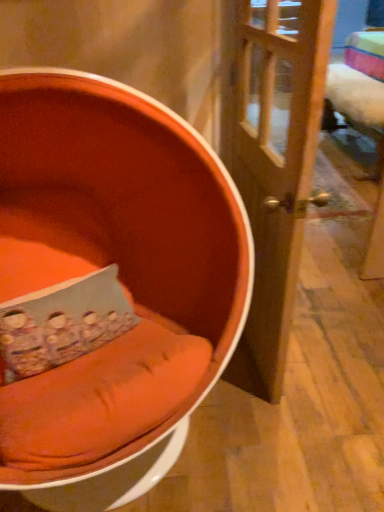
The image size is (384, 512). In order to click on wooden door at center in this screenshot , I will do `click(275, 168)`.

Which is behind, wooden door at center or floral fabric pillow at center?

floral fabric pillow at center is behind.

Is wooden door at center inside the boundaries of floral fabric pillow at center, or outside?

wooden door at center lies outside floral fabric pillow at center.

Is wooden door at center facing away from floral fabric pillow at center?

Correct, wooden door at center is looking away from floral fabric pillow at center.

In order to click on pillow located below the wooden door at center (from the image's perspective) in this screenshot , I will do `click(62, 323)`.

Locate an element on the screen. The width and height of the screenshot is (384, 512). chair that is under the wooden door at center (from a real-world perspective) is located at coordinates (110, 285).

Which object is positioned more to the right, wooden door at center or orange fabric chair at left?

Positioned to the right is wooden door at center.

From a real-world perspective, which is physically above, wooden door at center or orange fabric chair at left?

wooden door at center.

Consider the image. From a real-world perspective, is floral fabric pillow at center below orange fabric chair at left?

Correct, in the physical world, floral fabric pillow at center is lower than orange fabric chair at left.

Is orange fabric chair at left at the back of floral fabric pillow at center?

Yes.

Would you say floral fabric pillow at center is inside or outside orange fabric chair at left?

floral fabric pillow at center is spatially positioned inside orange fabric chair at left.

Where is `door on the right of floral fabric pillow at center`? This screenshot has width=384, height=512. door on the right of floral fabric pillow at center is located at coordinates (275, 168).

Is floral fabric pillow at center turned away from wooden door at center?

No, floral fabric pillow at center's orientation is not away from wooden door at center.

Does floral fabric pillow at center have a greater width compared to wooden door at center?

Indeed, floral fabric pillow at center has a greater width compared to wooden door at center.

Would you say wooden door at center is part of floral fabric pillow at center's contents?

Actually, wooden door at center is outside floral fabric pillow at center.

Is floral fabric pillow at center a part of orange fabric chair at left?

Yes, orange fabric chair at left is surrounding floral fabric pillow at center.

From a real-world perspective, is orange fabric chair at left physically located above or below floral fabric pillow at center?

orange fabric chair at left is situated higher than floral fabric pillow at center in the real world.

The height and width of the screenshot is (512, 384). In order to click on chair lying in front of the floral fabric pillow at center in this screenshot , I will do `click(110, 285)`.

Is orange fabric chair at left facing towards wooden door at center?

No, orange fabric chair at left is not aimed at wooden door at center.

Considering the sizes of objects orange fabric chair at left and wooden door at center in the image provided, who is shorter, orange fabric chair at left or wooden door at center?

orange fabric chair at left.

Does orange fabric chair at left contain wooden door at center?

No, wooden door at center is located outside of orange fabric chair at left.

This screenshot has width=384, height=512. Find the location of `pillow that appears below the wooden door at center (from the image's perspective)`. pillow that appears below the wooden door at center (from the image's perspective) is located at coordinates (62, 323).

The width and height of the screenshot is (384, 512). Identify the location of door lying on the right of orange fabric chair at left. (275, 168).

Looking at the image, which one is located closer to wooden door at center, floral fabric pillow at center or orange fabric chair at left?

The object closer to wooden door at center is orange fabric chair at left.

When comparing their distances from floral fabric pillow at center, does orange fabric chair at left or wooden door at center seem further?

wooden door at center.

Considering their positions, is wooden door at center positioned closer to floral fabric pillow at center than orange fabric chair at left?

Among the two, orange fabric chair at left is located nearer to floral fabric pillow at center.

Estimate the real-world distances between objects in this image. Which object is closer to orange fabric chair at left, wooden door at center or floral fabric pillow at center?

floral fabric pillow at center lies closer to orange fabric chair at left than the other object.

When comparing their distances from orange fabric chair at left, does floral fabric pillow at center or wooden door at center seem further?

wooden door at center lies further to orange fabric chair at left than the other object.

Considering their positions, is orange fabric chair at left positioned closer to wooden door at center than floral fabric pillow at center?

orange fabric chair at left.

I want to click on chair between floral fabric pillow at center and wooden door at center, so click(110, 285).